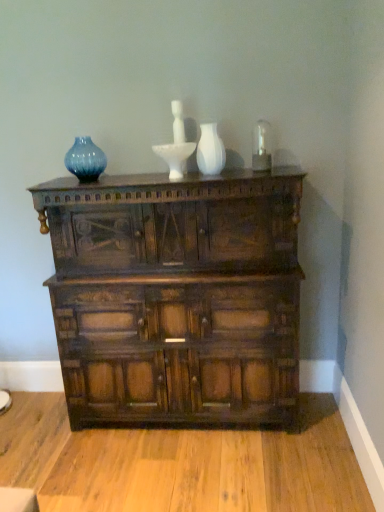
The width and height of the screenshot is (384, 512). Identify the location of vacant area that is in front of dark wood chest of drawers at center. (189, 474).